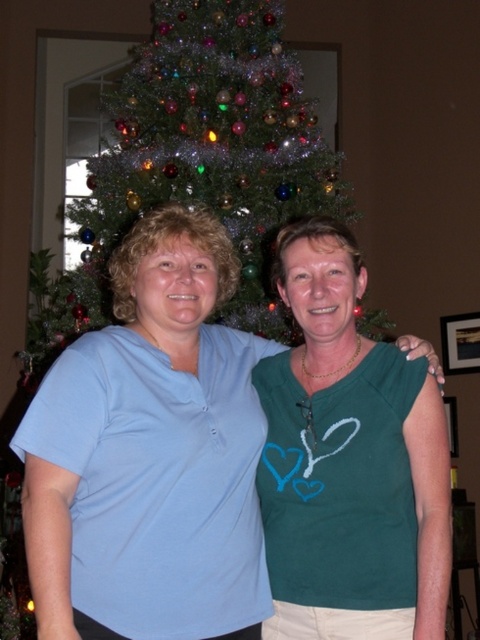
Question: Can you confirm if light blue cotton shirt at center is positioned below green glittery christmas tree at center?

Choices:
 (A) yes
 (B) no

Answer: (A)

Question: Which point is farther to the camera?

Choices:
 (A) light blue cotton shirt at center
 (B) green glittery christmas tree at center

Answer: (B)

Question: Is light blue cotton shirt at center thinner than green glittery christmas tree at center?

Choices:
 (A) no
 (B) yes

Answer: (B)

Question: Does light blue cotton shirt at center have a larger size compared to green glittery christmas tree at center?

Choices:
 (A) no
 (B) yes

Answer: (A)

Question: Among these points, which one is nearest to the camera?

Choices:
 (A) (159, 12)
 (B) (184, 518)

Answer: (B)